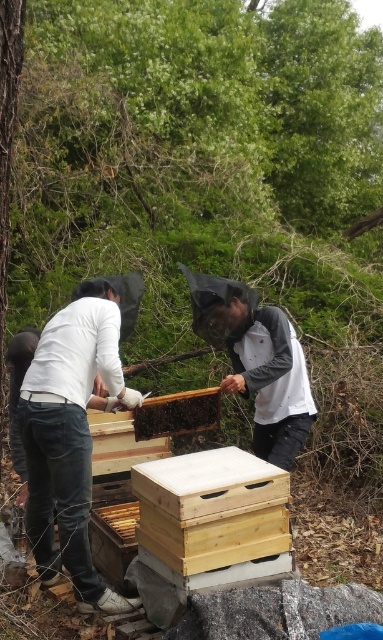
You are a visitor observing the beekeepers at the scene. You notice the light wood beehive at center and the white fabric beekeeper suit at center. Which object is positioned more to the left side of the scene?

The light wood beehive at center is positioned to the left of the white fabric beekeeper suit at center, so the light wood beehive at center is more to the left.

You are a beekeeper trying to determine the appropriate equipment size for your gear. Given the scene, which object between the white matte shirt at center and the wooden beehive at center is bigger in terms of size?

The white matte shirt at center has a larger size compared to the wooden beehive at center, so the white matte shirt at center is bigger.